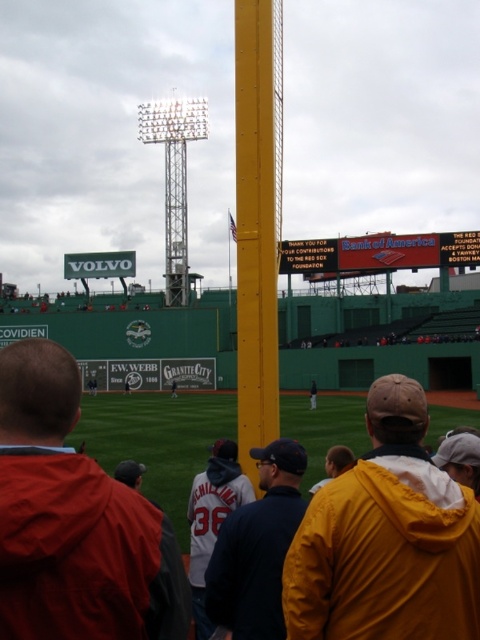
The image size is (480, 640). I want to click on yellow hooded jacket at center, so click(x=386, y=538).

Is yellow hooded jacket at center thinner than red plastic scoreboard at center?

Correct, yellow hooded jacket at center's width is less than red plastic scoreboard at center's.

Where is `yellow hooded jacket at center`? yellow hooded jacket at center is located at coordinates (386, 538).

Where is `yellow hooded jacket at center`? The image size is (480, 640). yellow hooded jacket at center is located at coordinates (386, 538).

Between point (242, 419) and point (439, 240), which one is positioned in front?

Point (242, 419) is more forward.

Locate an element on the screen. This screenshot has height=640, width=480. yellow painted metal pole at center is located at coordinates (257, 218).

Can you confirm if red plastic scoreboard at center is positioned to the right of dark blue baseball cap at center?

Correct, you'll find red plastic scoreboard at center to the right of dark blue baseball cap at center.

The height and width of the screenshot is (640, 480). What do you see at coordinates (380, 252) in the screenshot? I see `red plastic scoreboard at center` at bounding box center [380, 252].

Where is `red plastic scoreboard at center`? red plastic scoreboard at center is located at coordinates (380, 252).